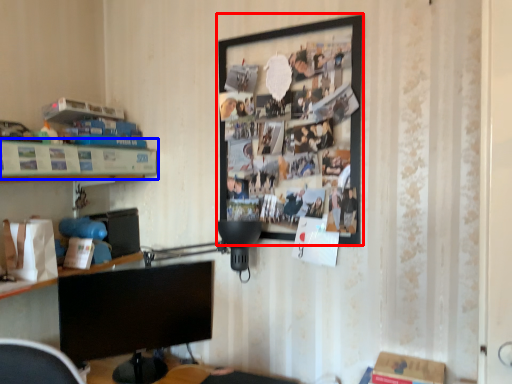
Question: Which of the following is the closest to the observer, picture frame (highlighted by a red box) or shelf (highlighted by a blue box)?

Choices:
 (A) picture frame
 (B) shelf

Answer: (B)